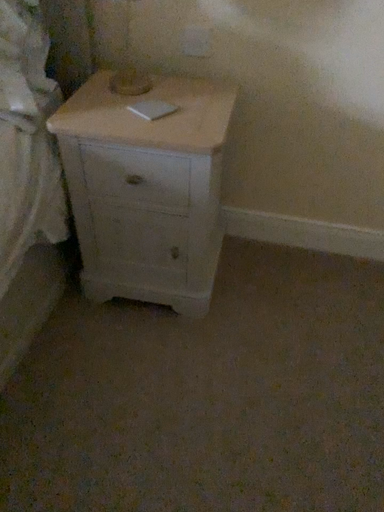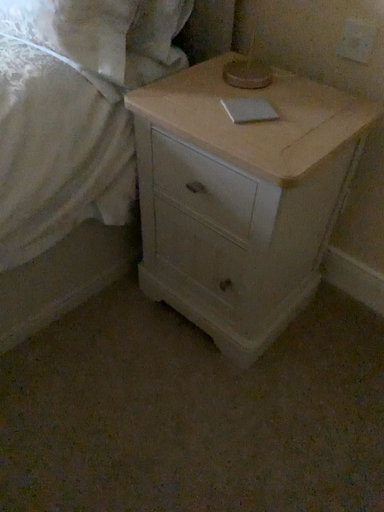
Question: Which way did the camera rotate in the video?

Choices:
 (A) rotated left
 (B) rotated right

Answer: (A)